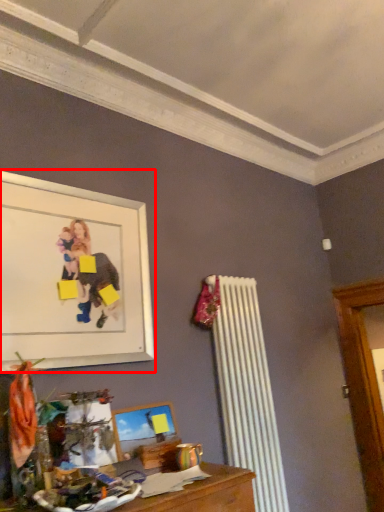
Question: From the image's perspective, what is the correct spatial positioning of picture frame (annotated by the red box) in reference to picture frame?

Choices:
 (A) above
 (B) below

Answer: (A)